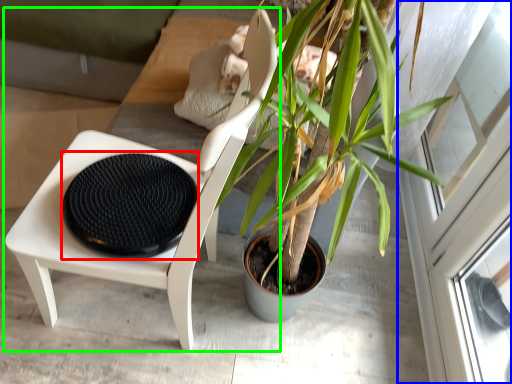
Question: Which object is positioned farthest from footrest (highlighted by a red box)? Select from screen door (highlighted by a blue box) and chair (highlighted by a green box).

Choices:
 (A) screen door
 (B) chair

Answer: (A)